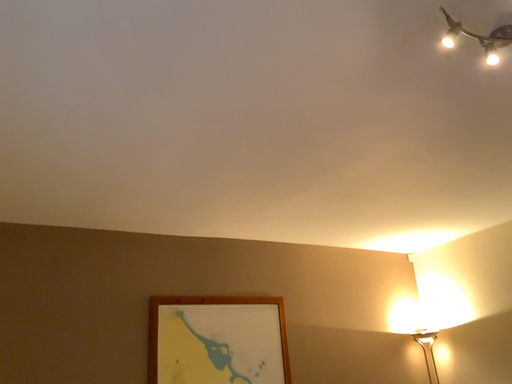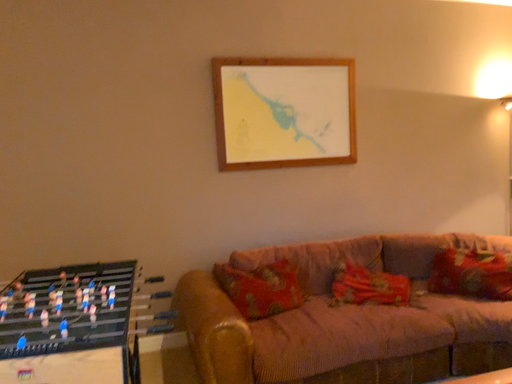
Question: How did the camera likely rotate when shooting the video?

Choices:
 (A) rotated upward
 (B) rotated downward

Answer: (B)